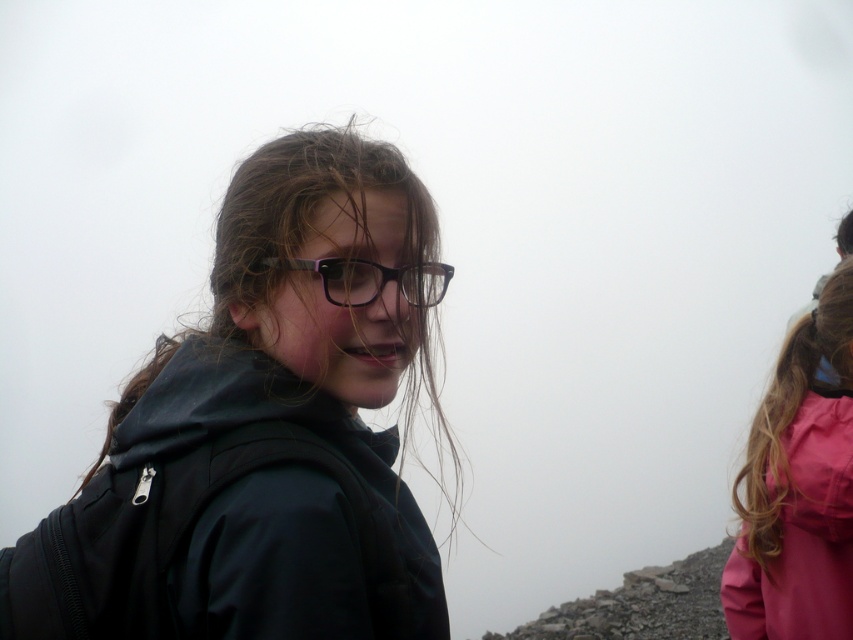
Question: Is matte black jacket at center above pink matte jacket at right?

Choices:
 (A) yes
 (B) no

Answer: (A)

Question: Among these objects, which one is nearest to the camera?

Choices:
 (A) pink matte jacket at right
 (B) matte black jacket at center

Answer: (B)

Question: Which is farther from the matte black jacket at center?

Choices:
 (A) black plastic glasses at center
 (B) pink matte jacket at right

Answer: (B)

Question: Is matte black jacket at center thinner than black plastic glasses at center?

Choices:
 (A) yes
 (B) no

Answer: (B)

Question: Can you confirm if matte black jacket at center is smaller than pink matte jacket at right?

Choices:
 (A) no
 (B) yes

Answer: (A)

Question: Which of the following is the farthest from the observer?

Choices:
 (A) (793, 593)
 (B) (328, 440)

Answer: (A)